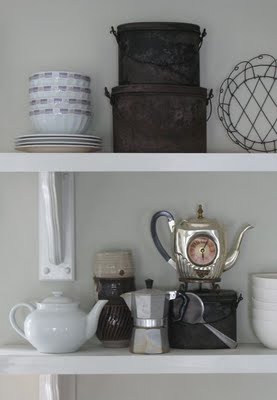
The width and height of the screenshot is (277, 400). What are the coordinates of `screw head on shelf brace` in the screenshot? It's located at (66, 177), (68, 271), (46, 270), (90, 338).